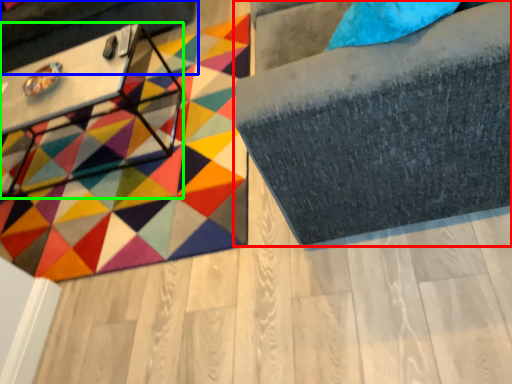
Question: Estimate the real-world distances between objects in this image. Which object is farther from furniture (highlighted by a red box), swivel chair (highlighted by a blue box) or table (highlighted by a green box)?

Choices:
 (A) swivel chair
 (B) table

Answer: (A)